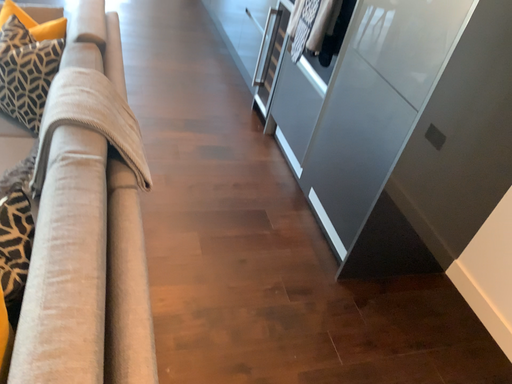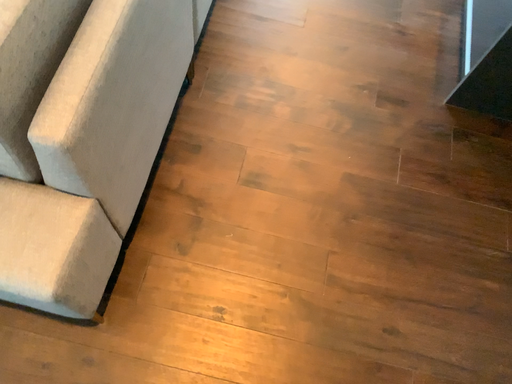
Question: Which way did the camera rotate in the video?

Choices:
 (A) rotated downward
 (B) rotated upward

Answer: (A)